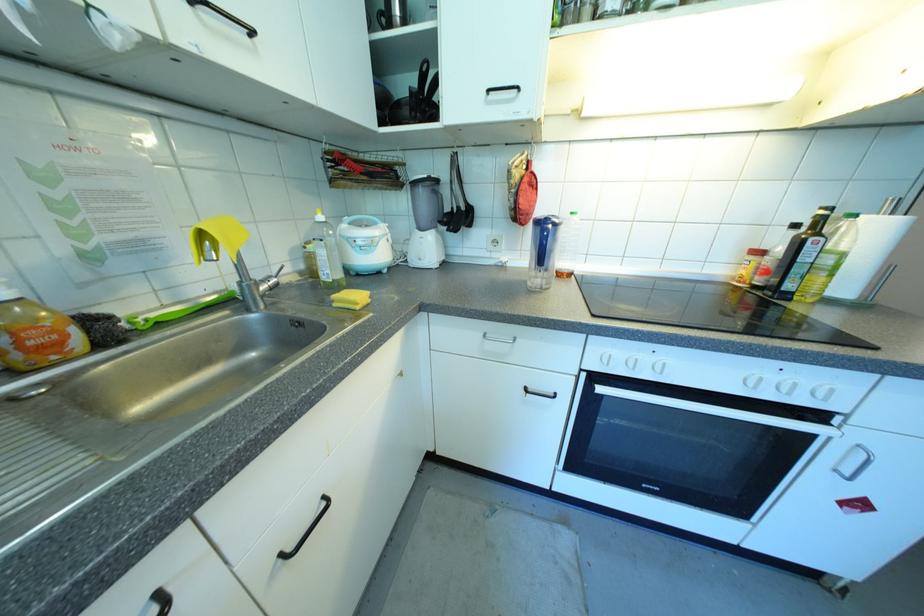
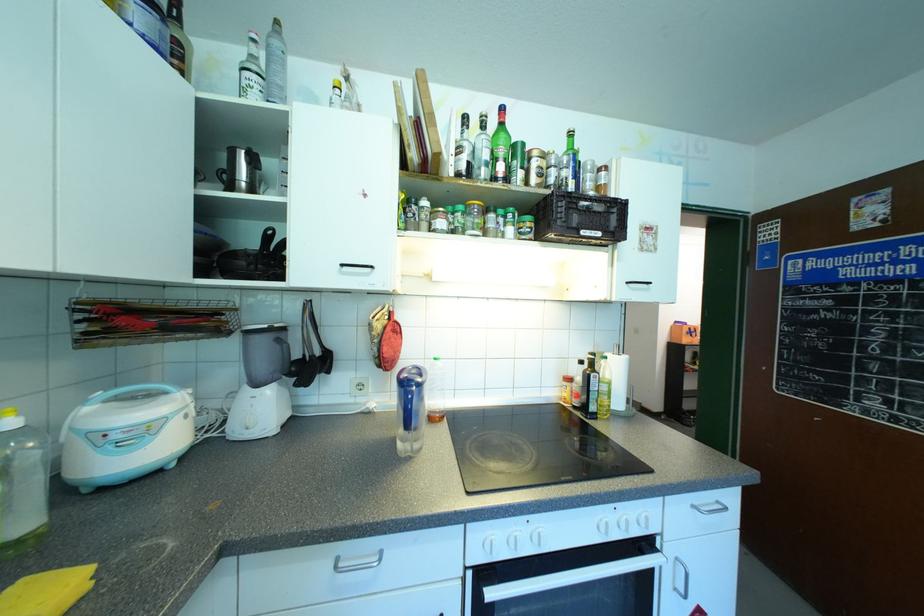
Find the pixel in the second image that matches point 379,231 in the first image.

(172, 403)